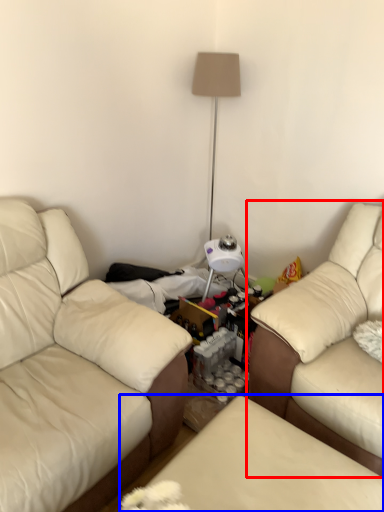
Question: Which object appears farthest to the camera in this image, studio couch (highlighted by a red box) or swivel chair (highlighted by a blue box)?

Choices:
 (A) studio couch
 (B) swivel chair

Answer: (A)